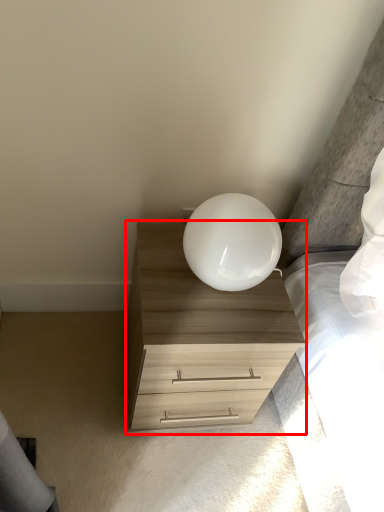
Question: From the image's perspective, what is the correct spatial positioning of chest of drawers (annotated by the red box) in reference to lamp?

Choices:
 (A) below
 (B) above

Answer: (A)